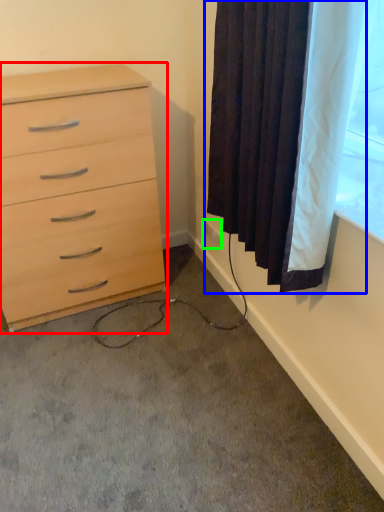
Question: Based on their relative distances, which object is nearer to chest of drawers (highlighted by a red box)? Choose from curtain (highlighted by a blue box) and electric outlet (highlighted by a green box).

Choices:
 (A) curtain
 (B) electric outlet

Answer: (A)